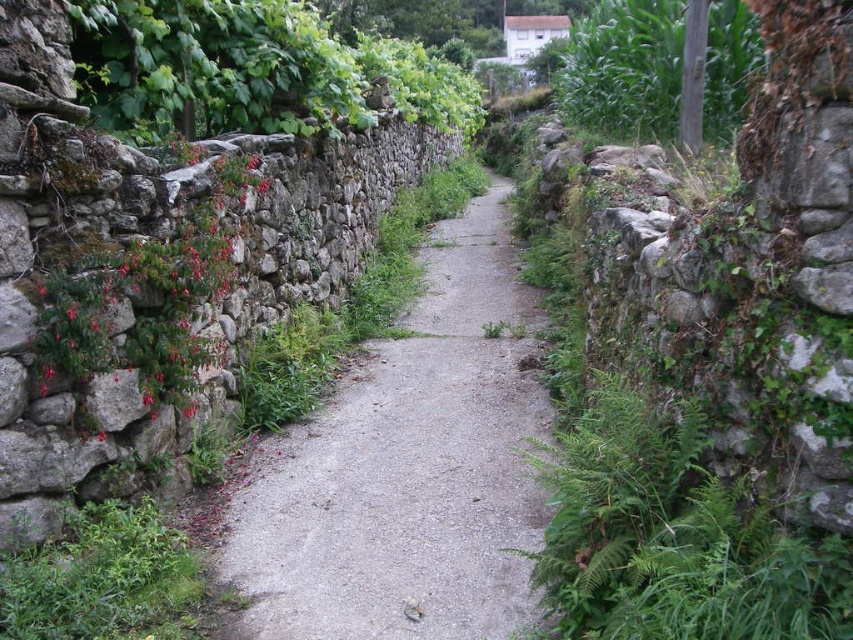
Can you confirm if green leafy fern at right is positioned to the right of green leafy plant at upper left?

Correct, you'll find green leafy fern at right to the right of green leafy plant at upper left.

Based on the photo, who is shorter, green leafy fern at right or green leafy plant at upper left?

green leafy fern at right

Is point (683, 410) farther from camera compared to point (303, 29)?

That is False.

Identify the location of green leafy fern at right. (672, 538).

Who is taller, green leafy plant at upper left or green leafy plant at upper right?

green leafy plant at upper right is taller.

Is point (318, 115) positioned after point (592, 58)?

No, (318, 115) is in front of (592, 58).

Image resolution: width=853 pixels, height=640 pixels. I want to click on green leafy plant at upper left, so click(251, 68).

Is green leafy plant at upper left above pink matte flowers at left?

Yes, green leafy plant at upper left is above pink matte flowers at left.

Does green leafy plant at upper left come behind pink matte flowers at left?

Yes, green leafy plant at upper left is further from the viewer.

Between point (271, 76) and point (132, 289), which one is positioned behind?

Positioned behind is point (271, 76).

This screenshot has width=853, height=640. Identify the location of green leafy plant at upper left. (251, 68).